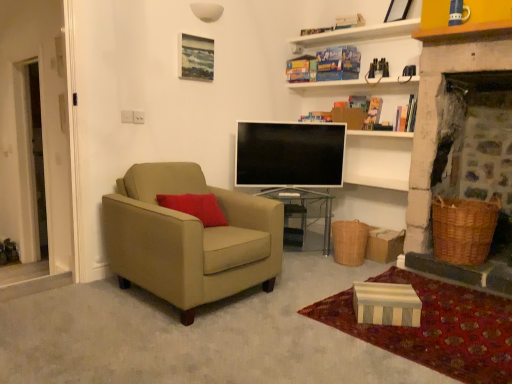
Locate an element on the screen. This screenshot has height=384, width=512. vacant space positioned to the left of striped cardboard box at lower right is located at coordinates (333, 308).